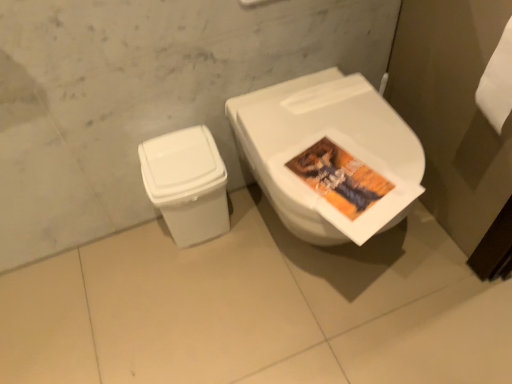
Question: From the image's perspective, is white plastic trash can at lower left located beneath white glossy toilet at center?

Choices:
 (A) no
 (B) yes

Answer: (B)

Question: Would you consider white plastic trash can at lower left to be distant from white glossy toilet at center?

Choices:
 (A) no
 (B) yes

Answer: (A)

Question: Could you tell me if white plastic trash can at lower left is turned towards white glossy toilet at center?

Choices:
 (A) yes
 (B) no

Answer: (B)

Question: From a real-world perspective, is white plastic trash can at lower left physically below white glossy toilet at center?

Choices:
 (A) no
 (B) yes

Answer: (B)

Question: Does white plastic trash can at lower left have a greater width compared to white glossy toilet at center?

Choices:
 (A) no
 (B) yes

Answer: (A)

Question: Can you confirm if white plastic trash can at lower left is positioned to the left of white glossy toilet at center?

Choices:
 (A) yes
 (B) no

Answer: (A)

Question: Does white glossy toilet at center have a larger size compared to white plastic trash can at lower left?

Choices:
 (A) no
 (B) yes

Answer: (B)

Question: Is white glossy toilet at center at the left side of white plastic trash can at lower left?

Choices:
 (A) no
 (B) yes

Answer: (A)

Question: Is white glossy toilet at center shorter than white plastic trash can at lower left?

Choices:
 (A) no
 (B) yes

Answer: (A)

Question: From the image's perspective, does white glossy toilet at center appear lower than white plastic trash can at lower left?

Choices:
 (A) no
 (B) yes

Answer: (A)

Question: Considering the relative sizes of white glossy toilet at center and white plastic trash can at lower left in the image provided, is white glossy toilet at center taller than white plastic trash can at lower left?

Choices:
 (A) yes
 (B) no

Answer: (A)

Question: Could white plastic trash can at lower left be considered to be inside white glossy toilet at center?

Choices:
 (A) no
 (B) yes

Answer: (A)

Question: Considering the relative positions of white glossy toilet at center and white plastic trash can at lower left in the image provided, is white glossy toilet at center to the left or to the right of white plastic trash can at lower left?

Choices:
 (A) left
 (B) right

Answer: (B)